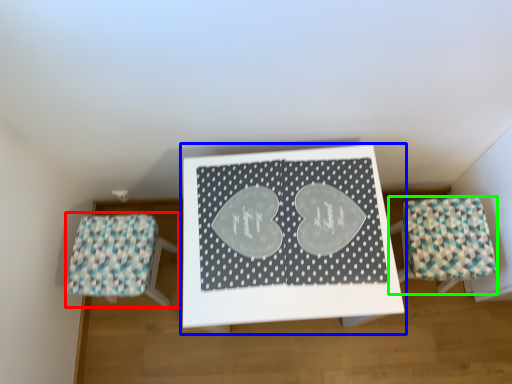
Question: Which object is the closest to the furniture (highlighted by a red box)? Choose among these: table (highlighted by a blue box) or furniture (highlighted by a green box).

Choices:
 (A) table
 (B) furniture

Answer: (A)